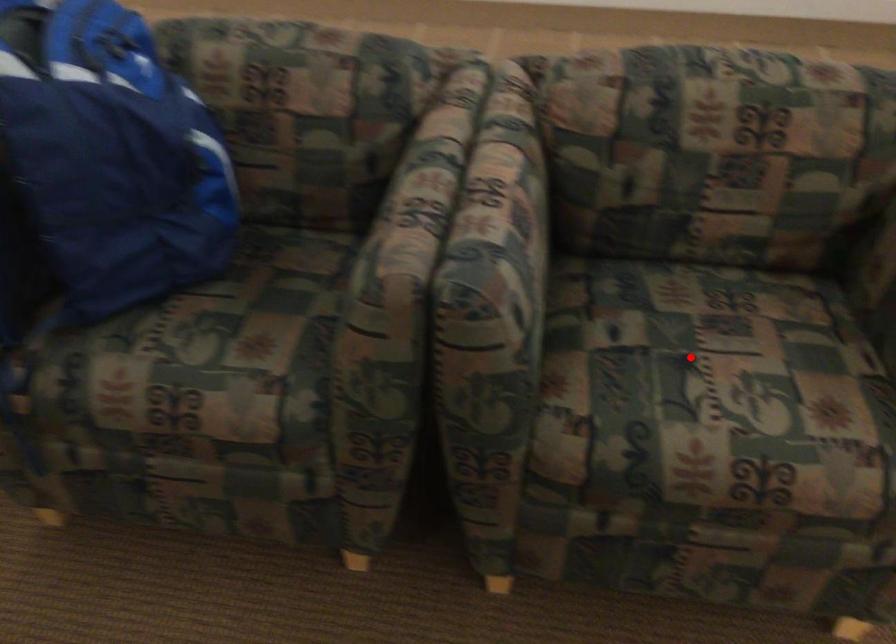
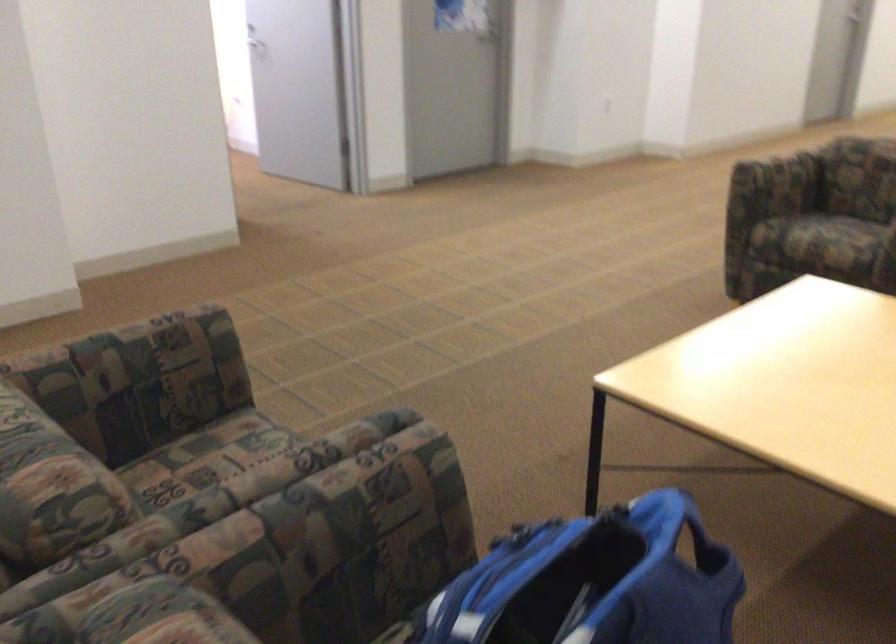
Question: I am providing you with two images of the same scene from different viewpoints. A red point is marked on the first image. Can you still see the location of the red point in image 2?

Choices:
 (A) Yes
 (B) No

Answer: (B)